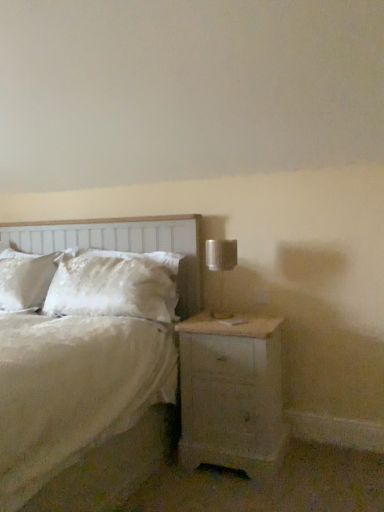
Question: From a real-world perspective, is white fluffy pillow at center positioned under white satin bed at center based on gravity?

Choices:
 (A) yes
 (B) no

Answer: (B)

Question: Is white fluffy pillow at center positioned far away from white satin bed at center?

Choices:
 (A) yes
 (B) no

Answer: (B)

Question: Considering the relative positions of white fluffy pillow at center and white satin bed at center in the image provided, is white fluffy pillow at center in front of white satin bed at center?

Choices:
 (A) yes
 (B) no

Answer: (B)

Question: Is white satin bed at center a part of white fluffy pillow at center?

Choices:
 (A) yes
 (B) no

Answer: (B)

Question: Is white fluffy pillow at center facing towards white satin bed at center?

Choices:
 (A) yes
 (B) no

Answer: (A)

Question: From a real-world perspective, is white fluffy pillow at center on white satin bed at center?

Choices:
 (A) yes
 (B) no

Answer: (A)

Question: From a real-world perspective, does white satin bed at center stand above white wood headboard at left?

Choices:
 (A) no
 (B) yes

Answer: (A)

Question: Is the depth of white satin bed at center less than that of white wood headboard at left?

Choices:
 (A) no
 (B) yes

Answer: (B)

Question: Is white satin bed at center outside white wood headboard at left?

Choices:
 (A) yes
 (B) no

Answer: (A)

Question: Can you confirm if white satin bed at center is thinner than white wood headboard at left?

Choices:
 (A) yes
 (B) no

Answer: (B)

Question: From a real-world perspective, does white satin bed at center sit lower than white wood headboard at left?

Choices:
 (A) yes
 (B) no

Answer: (A)

Question: Is white satin bed at center far from white wood headboard at left?

Choices:
 (A) yes
 (B) no

Answer: (B)

Question: Is white painted wood nightstand at lower right turned away from white wood headboard at left?

Choices:
 (A) yes
 (B) no

Answer: (B)